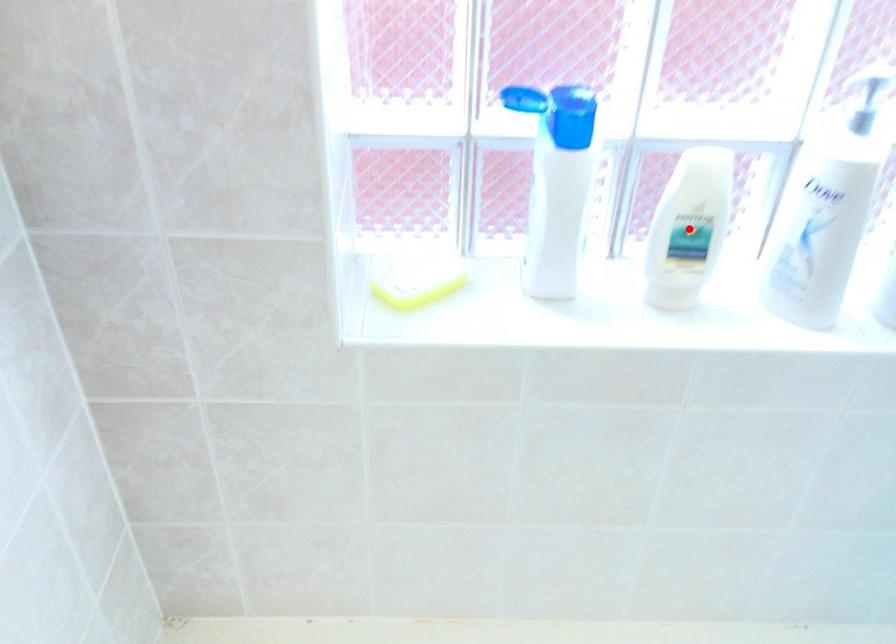
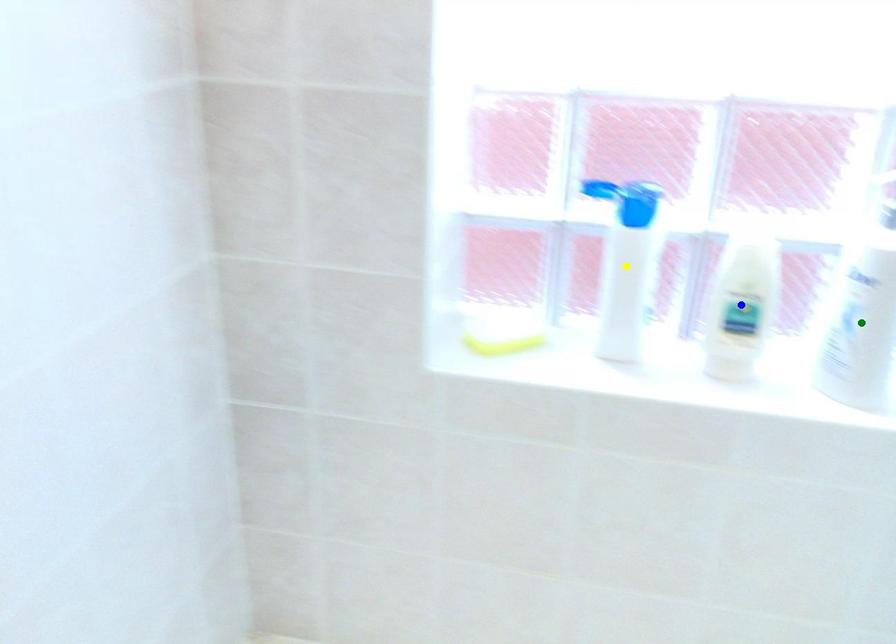
Question: I am providing you with two images of the same scene from different viewpoints. A red point is marked on the first image. You are given multiple points on the second image. In image 2, which mark is for the same physical point as the one in image 1?

Choices:
 (A) yellow point
 (B) green point
 (C) blue point

Answer: (C)